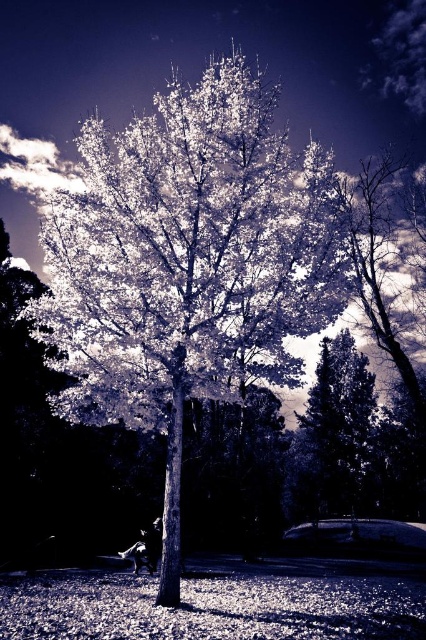
Question: Does white textured tree at center lie in front of smooth bark tree at lower right?

Choices:
 (A) no
 (B) yes

Answer: (B)

Question: Does white textured tree at center have a lesser width compared to smooth bark tree at lower right?

Choices:
 (A) no
 (B) yes

Answer: (A)

Question: Which point is closer to the camera taking this photo?

Choices:
 (A) (345, 419)
 (B) (268, 104)

Answer: (B)

Question: Among these objects, which one is farthest from the camera?

Choices:
 (A) smooth bark tree at lower right
 (B) white textured tree at center

Answer: (A)

Question: Does white textured tree at center appear on the right side of smooth bark tree at lower right?

Choices:
 (A) yes
 (B) no

Answer: (B)